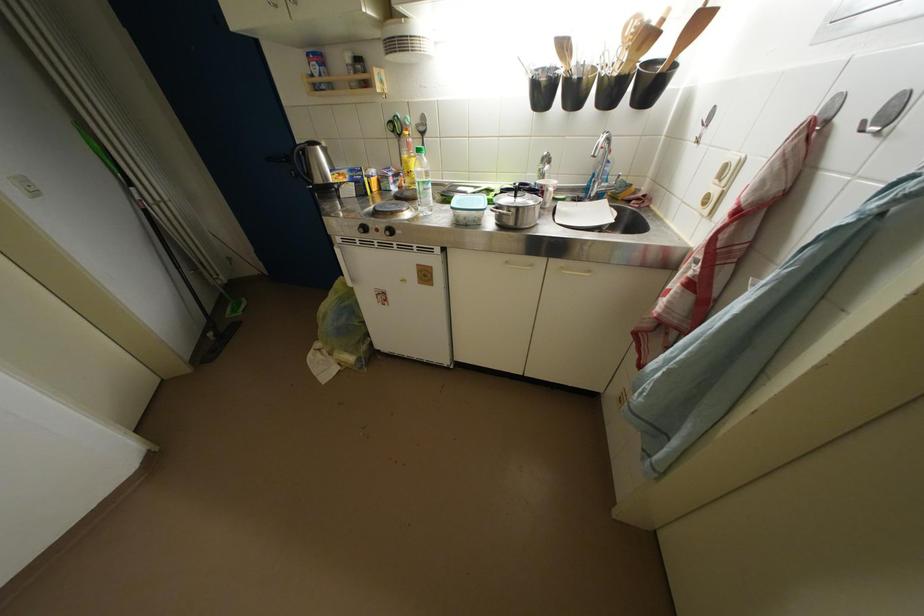
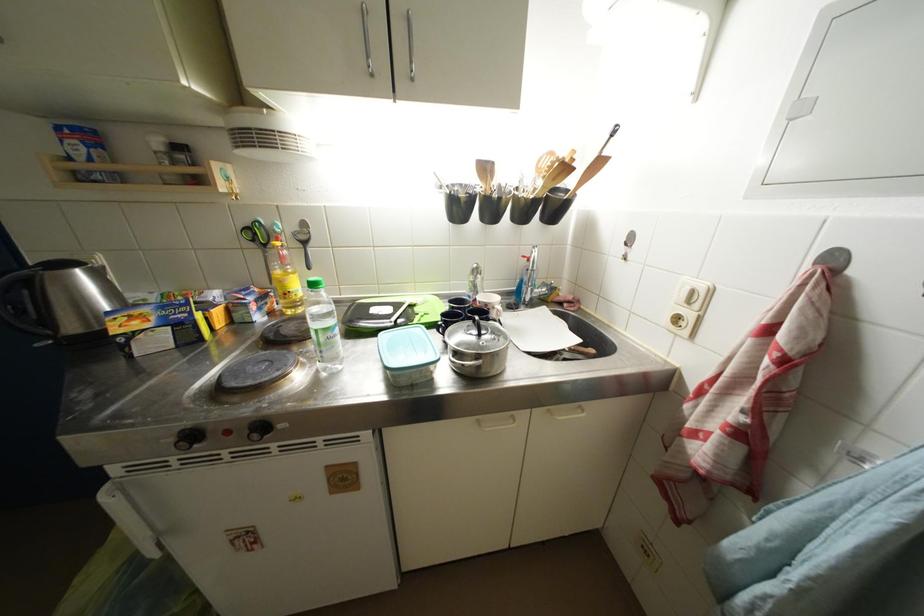
Find the pixel in the second image that matches point 514,265 in the first image.

(485, 424)